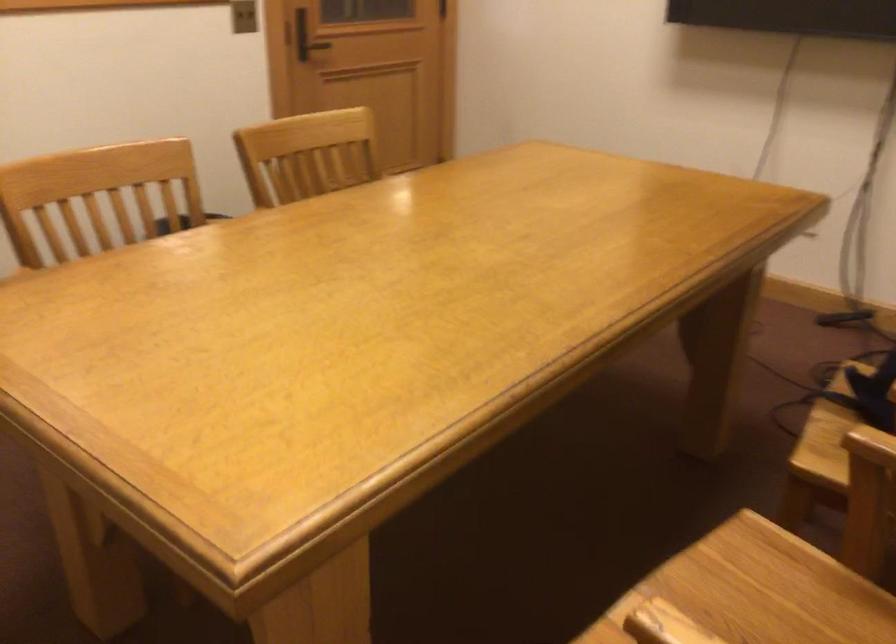
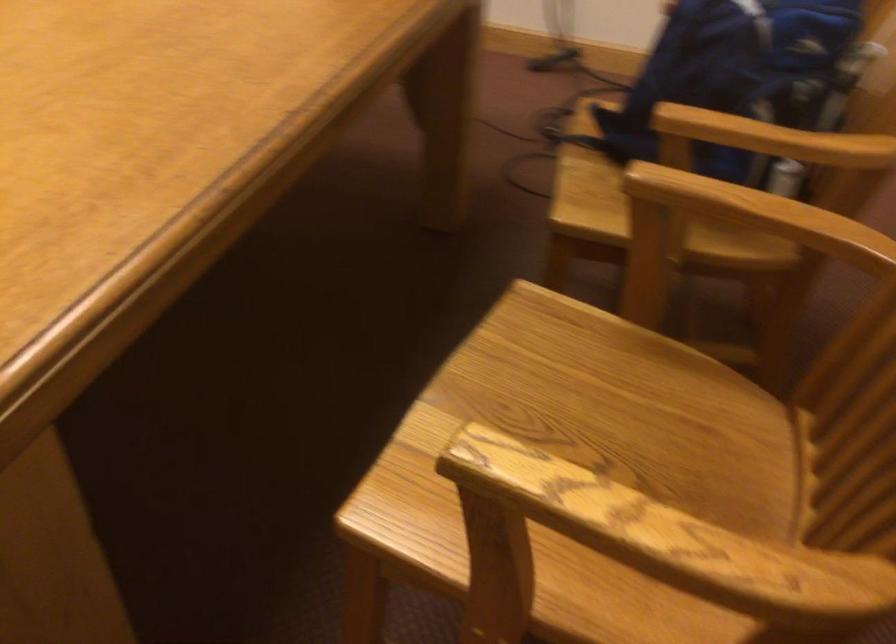
Locate, in the second image, the point that corresponds to pixel 825 440 in the first image.

(584, 187)